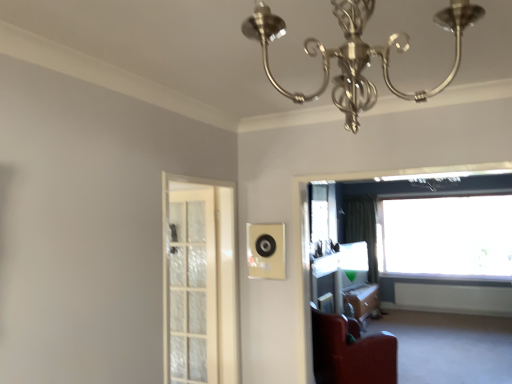
Question: From the image's perspective, is matte black speaker at center on transparent glass window at upper right, which is counted as the first window, starting from the front?

Choices:
 (A) no
 (B) yes

Answer: (B)

Question: Is matte black speaker at center bigger than transparent glass window at upper right, placed as the second window when sorted from back to front?

Choices:
 (A) no
 (B) yes

Answer: (A)

Question: Considering the relative sizes of matte black speaker at center and transparent glass window at upper right, placed as the second window when sorted from back to front, in the image provided, is matte black speaker at center wider than transparent glass window at upper right, placed as the second window when sorted from back to front,?

Choices:
 (A) no
 (B) yes

Answer: (A)

Question: Is the position of matte black speaker at center more distant than that of transparent glass window at upper right, which is counted as the first window, starting from the front?

Choices:
 (A) yes
 (B) no

Answer: (A)

Question: Does matte black speaker at center have a lesser height compared to transparent glass window at upper right, placed as the second window when sorted from back to front?

Choices:
 (A) no
 (B) yes

Answer: (B)

Question: Is matte black speaker at center positioned in front of transparent glass window at upper right, marked as the 2th window in a right-to-left arrangement?

Choices:
 (A) yes
 (B) no

Answer: (B)

Question: Does transparent glass window at upper right, placed as the second window when sorted from back to front, have a greater width compared to velvet red armchair at lower right?

Choices:
 (A) no
 (B) yes

Answer: (B)

Question: Does transparent glass window at upper right, marked as the 2th window in a right-to-left arrangement, have a greater height compared to velvet red armchair at lower right?

Choices:
 (A) no
 (B) yes

Answer: (B)

Question: Considering the relative sizes of transparent glass window at upper right, which is counted as the first window, starting from the front, and velvet red armchair at lower right in the image provided, is transparent glass window at upper right, which is counted as the first window, starting from the front, shorter than velvet red armchair at lower right?

Choices:
 (A) yes
 (B) no

Answer: (B)

Question: Is transparent glass window at upper right, placed as the second window when sorted from back to front, to the left of velvet red armchair at lower right from the viewer's perspective?

Choices:
 (A) no
 (B) yes

Answer: (A)

Question: Does transparent glass window at upper right, the 1th window when ordered from left to right, contain velvet red armchair at lower right?

Choices:
 (A) yes
 (B) no

Answer: (B)

Question: From the image's perspective, is transparent glass window at upper right, the 1th window when ordered from left to right, below velvet red armchair at lower right?

Choices:
 (A) yes
 (B) no

Answer: (B)

Question: Does transparent glass window at upper right, placed as the second window when sorted from back to front, have a lesser height compared to wooden table at lower right?

Choices:
 (A) no
 (B) yes

Answer: (A)